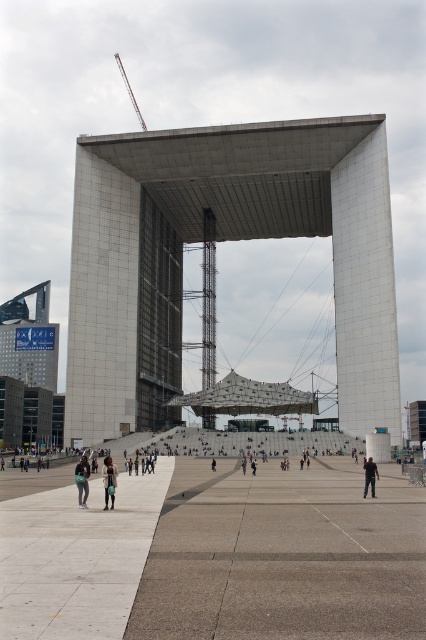
Question: Is concrete at center closer to the viewer compared to dark blue jeans at lower left?

Choices:
 (A) yes
 (B) no

Answer: (A)

Question: Which object is closer to the camera taking this photo?

Choices:
 (A) concrete at center
 (B) dark gray fabric at center
 (C) white concrete structure at center

Answer: (A)

Question: Does matte glass tower at lower left have a greater width compared to dark blue jeans at lower left?

Choices:
 (A) yes
 (B) no

Answer: (A)

Question: Which point appears farthest from the camera in this image?

Choices:
 (A) (143, 586)
 (B) (333, 218)
 (C) (19, 342)

Answer: (C)

Question: Among these points, which one is farthest from the camera?

Choices:
 (A) (32, 358)
 (B) (351, 177)
 (C) (391, 616)
 (D) (80, 497)

Answer: (A)

Question: Is matte glass tower at lower left positioned before dark blue jeans at lower left?

Choices:
 (A) yes
 (B) no

Answer: (B)